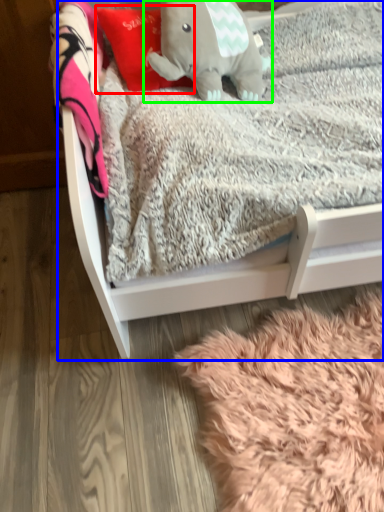
Question: Estimate the real-world distances between objects in this image. Which object is farther from throw pillow (highlighted by a red box), infant bed (highlighted by a blue box) or elephant (highlighted by a green box)?

Choices:
 (A) infant bed
 (B) elephant

Answer: (A)